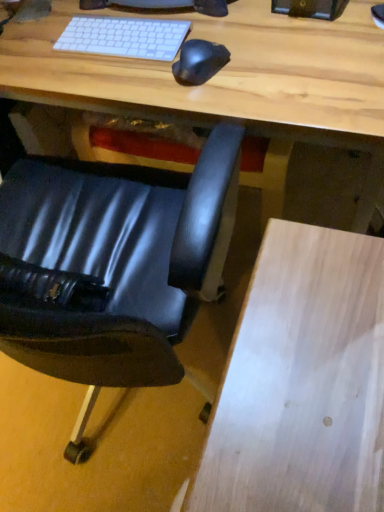
Question: In the image, is black rubber mouse at center on the left side or the right side of black leather chair at lower left?

Choices:
 (A) left
 (B) right

Answer: (B)

Question: From the image's perspective, is black rubber mouse at center above or below black leather chair at lower left?

Choices:
 (A) above
 (B) below

Answer: (A)

Question: Which object is positioned closest to the black rubber mouse at center?

Choices:
 (A) light wood desk at center
 (B) black leather chair at lower left

Answer: (A)

Question: Estimate the real-world distances between objects in this image. Which object is farther from the black rubber mouse at center?

Choices:
 (A) black leather chair at lower left
 (B) light wood desk at center

Answer: (A)